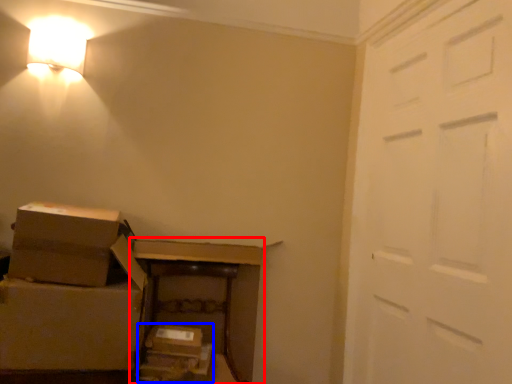
Question: Which object appears farthest to the camera in this image, furniture (highlighted by a red box) or storage box (highlighted by a blue box)?

Choices:
 (A) furniture
 (B) storage box

Answer: (B)